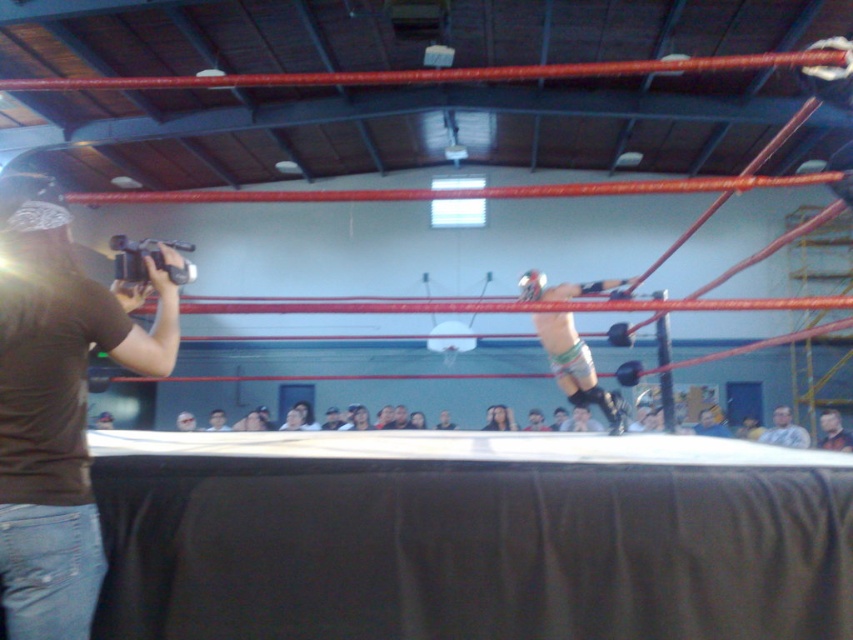
Question: Is shiny black boots at upper right to the left of smooth skin face at center from the viewer's perspective?

Choices:
 (A) yes
 (B) no

Answer: (B)

Question: Among these points, which one is farthest from the camera?

Choices:
 (A) (387, 420)
 (B) (24, 595)
 (C) (775, 436)
 (D) (521, 294)

Answer: (A)

Question: Can you confirm if brown fabric camera at left is thinner than shiny black boots at upper right?

Choices:
 (A) no
 (B) yes

Answer: (B)

Question: Which point is farther to the camera?

Choices:
 (A) (4, 220)
 (B) (409, 426)
 (C) (804, 440)
 (D) (578, 381)

Answer: (B)

Question: Which point is farther to the camera?

Choices:
 (A) shiny black boots at upper right
 (B) brown fabric camera at left

Answer: (A)

Question: Does gray fabric shirt at upper right have a lesser width compared to smooth skin face at center?

Choices:
 (A) yes
 (B) no

Answer: (B)